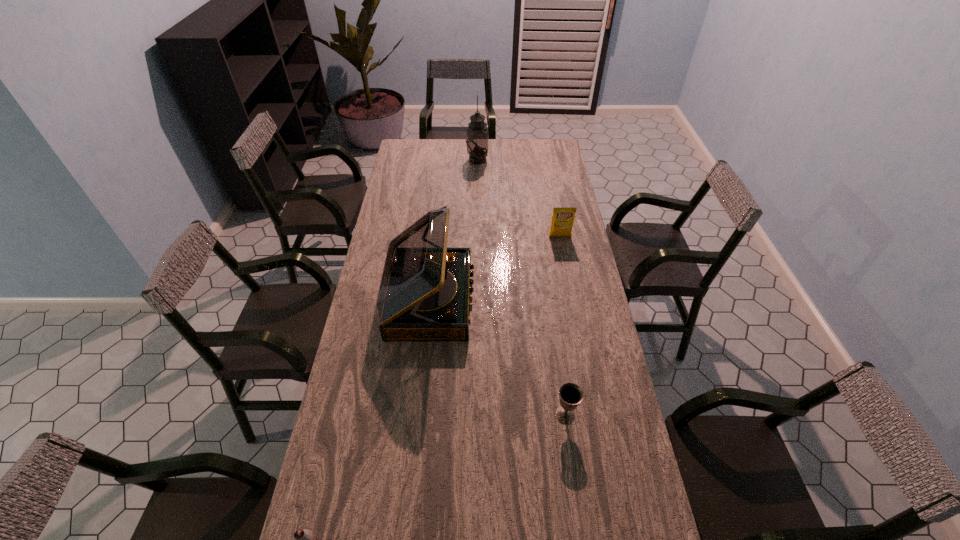
Identify the location of the farthest object. (477, 133).

Where is `oil lamp`? This screenshot has width=960, height=540. oil lamp is located at coordinates (477, 133).

This screenshot has width=960, height=540. I want to click on the second tallest object, so click(x=424, y=292).

Image resolution: width=960 pixels, height=540 pixels. Identify the location of the third farthest object. (424, 292).

This screenshot has height=540, width=960. I want to click on the rightmost object, so click(x=562, y=222).

Image resolution: width=960 pixels, height=540 pixels. What are the coordinates of `crisp (potato chip)` in the screenshot? It's located at (x=562, y=222).

This screenshot has height=540, width=960. Identify the location of the fourth farthest object. (570, 395).

At what (x,y) coordinates should I click in order to perform the action: click on the second object from right to left. Please return your answer as a coordinate pair (x, y). The height and width of the screenshot is (540, 960). Looking at the image, I should click on (570, 395).

In order to click on free spot located on the left of the oil lamp in this screenshot , I will do `click(419, 160)`.

This screenshot has width=960, height=540. Find the location of `free spot located 0.060m on the front-facing side of the record player`. free spot located 0.060m on the front-facing side of the record player is located at coordinates (490, 300).